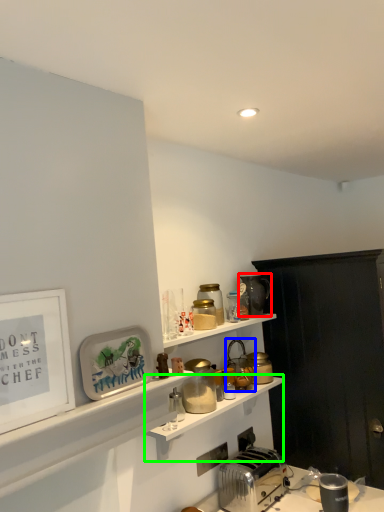
Question: Which is farther away from appliance (highlighted by a red box)? appliance (highlighted by a blue box) or shelf (highlighted by a green box)?

Choices:
 (A) appliance
 (B) shelf

Answer: (B)